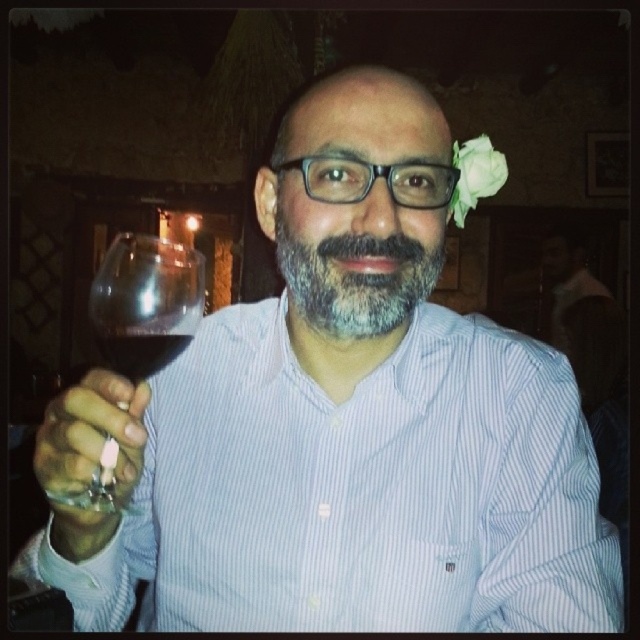
Does gray matte beard at center appear on the right side of white paper flower at upper right?

Incorrect, gray matte beard at center is not on the right side of white paper flower at upper right.

Does gray matte beard at center have a greater height compared to white paper flower at upper right?

No, gray matte beard at center is not taller than white paper flower at upper right.

Does point (353, 304) lie in front of point (486, 136)?

Yes.

Identify the location of gray matte beard at center. [x=355, y=280].

Is transparent glass at upper left bigger than white paper flower at upper right?

No.

What do you see at coordinates (145, 301) in the screenshot? This screenshot has width=640, height=640. I see `transparent glass at upper left` at bounding box center [145, 301].

Does point (108, 497) come in front of point (460, 161)?

Yes, it is in front of point (460, 161).

Image resolution: width=640 pixels, height=640 pixels. Identify the location of transparent glass at upper left. (145, 301).

Does gray matte beard at center appear over dark red glass at center?

Indeed, gray matte beard at center is positioned over dark red glass at center.

Locate an element on the screen. gray matte beard at center is located at coordinates (355, 280).

What are the coordinates of `gray matte beard at center` in the screenshot? It's located at (355, 280).